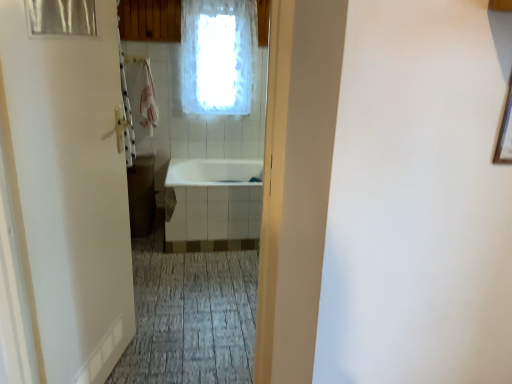
The height and width of the screenshot is (384, 512). Identify the location of white matte door at left. (68, 187).

Describe the element at coordinates (217, 56) in the screenshot. This screenshot has width=512, height=384. I see `white frosted glass window at upper center` at that location.

The height and width of the screenshot is (384, 512). In order to click on transparent plastic shower curtain at upper left in this screenshot , I will do `click(62, 17)`.

Would you consider white glossy bathtub at center to be distant from transparent plastic shower curtain at upper left?

Yes, white glossy bathtub at center and transparent plastic shower curtain at upper left are quite far apart.

From the image's perspective, is white glossy bathtub at center below transparent plastic shower curtain at upper left?

Yes.

Which object is thinner, white glossy bathtub at center or transparent plastic shower curtain at upper left?

A: transparent plastic shower curtain at upper left is thinner.

Is white frosted glass window at upper center to the right of white matte door at left from the viewer's perspective?

Correct, you'll find white frosted glass window at upper center to the right of white matte door at left.

Would you say white frosted glass window at upper center is outside white matte door at left?

Yes, white frosted glass window at upper center is located beyond the bounds of white matte door at left.

Does point (197, 41) come in front of point (103, 70)?

No, it is not.

Based on the photo, considering the relative sizes of white frosted glass window at upper center and white matte door at left in the image provided, is white frosted glass window at upper center wider than white matte door at left?

Correct, the width of white frosted glass window at upper center exceeds that of white matte door at left.

Could you tell me if white matte door at left is turned towards transparent plastic shower curtain at upper left?

Yes, white matte door at left is turned towards transparent plastic shower curtain at upper left.

At what (x,y) coordinates should I click in order to perform the action: click on shower curtain behind the white matte door at left. Please return your answer as a coordinate pair (x, y). This screenshot has width=512, height=384. Looking at the image, I should click on (62, 17).

In the scene shown: Between white matte door at left and transparent plastic shower curtain at upper left, which one has more height?

With more height is white matte door at left.

Is white matte door at left at the left side of transparent plastic shower curtain at upper left?

No, white matte door at left is not to the left of transparent plastic shower curtain at upper left.

Which is more to the left, transparent plastic shower curtain at upper left or white glossy bathtub at center?

transparent plastic shower curtain at upper left is more to the left.

Between transparent plastic shower curtain at upper left and white glossy bathtub at center, which one has smaller width?

With smaller width is transparent plastic shower curtain at upper left.

Is white glossy bathtub at center inside transparent plastic shower curtain at upper left?

Definitely not — white glossy bathtub at center is not inside transparent plastic shower curtain at upper left.

From the image's perspective, who appears lower, transparent plastic shower curtain at upper left or white glossy bathtub at center?

white glossy bathtub at center, from the image's perspective.

From the image's perspective, is white frosted glass window at upper center under transparent plastic shower curtain at upper left?

No, from the image's perspective, white frosted glass window at upper center is not beneath transparent plastic shower curtain at upper left.

From the picture: How different are the orientations of white frosted glass window at upper center and transparent plastic shower curtain at upper left in degrees?

The facing directions of white frosted glass window at upper center and transparent plastic shower curtain at upper left are 72.3 degrees apart.

Which of these two, white frosted glass window at upper center or transparent plastic shower curtain at upper left, is thinner?

Thinner between the two is transparent plastic shower curtain at upper left.

Considering the relative sizes of white glossy bathtub at center and white frosted glass window at upper center in the image provided, is white glossy bathtub at center shorter than white frosted glass window at upper center?

Correct, white glossy bathtub at center is not as tall as white frosted glass window at upper center.

Does white glossy bathtub at center have a lesser width compared to white frosted glass window at upper center?

Incorrect, the width of white glossy bathtub at center is not less than that of white frosted glass window at upper center.

Consider the image. Based on their positions, is white glossy bathtub at center located to the left or right of white frosted glass window at upper center?

From the image, it's evident that white glossy bathtub at center is to the left of white frosted glass window at upper center.

What's the angular difference between white glossy bathtub at center and white frosted glass window at upper center's facing directions?

0.715 degrees.

Is white frosted glass window at upper center inside transparent plastic shower curtain at upper left?

That's incorrect, white frosted glass window at upper center is not inside transparent plastic shower curtain at upper left.

Which is nearer, [49,25] or [237,71]?

Point [49,25] is closer to the camera than point [237,71].

From a real-world perspective, who is located higher, transparent plastic shower curtain at upper left or white frosted glass window at upper center?

From a 3D spatial view, transparent plastic shower curtain at upper left is above.

I want to click on shower curtain above the white glossy bathtub at center (from a real-world perspective), so click(x=62, y=17).

Identify the location of door located underneath the white frosted glass window at upper center (from a real-world perspective). The height and width of the screenshot is (384, 512). (68, 187).

Consider the image. When comparing their distances from white frosted glass window at upper center, does white matte door at left or white glossy bathtub at center seem closer?

The object closer to white frosted glass window at upper center is white glossy bathtub at center.

From the image, which object appears to be nearer to transparent plastic shower curtain at upper left, white frosted glass window at upper center or white glossy bathtub at center?

Among the two, white glossy bathtub at center is located nearer to transparent plastic shower curtain at upper left.

When comparing their distances from white matte door at left, does white glossy bathtub at center or transparent plastic shower curtain at upper left seem closer?

transparent plastic shower curtain at upper left is positioned closer to the anchor white matte door at left.

From the image, which object appears to be nearer to white frosted glass window at upper center, transparent plastic shower curtain at upper left or white matte door at left?

Based on the image, white matte door at left appears to be nearer to white frosted glass window at upper center.

Estimate the real-world distances between objects in this image. Which object is further from white matte door at left, transparent plastic shower curtain at upper left or white glossy bathtub at center?

white glossy bathtub at center.

From the image, which object appears to be nearer to transparent plastic shower curtain at upper left, white frosted glass window at upper center or white matte door at left?

Based on the image, white matte door at left appears to be nearer to transparent plastic shower curtain at upper left.

When comparing their distances from white frosted glass window at upper center, does white glossy bathtub at center or transparent plastic shower curtain at upper left seem closer?

white glossy bathtub at center is positioned closer to the anchor white frosted glass window at upper center.

Looking at the image, which one is located closer to white frosted glass window at upper center, white glossy bathtub at center or white matte door at left?

Among the two, white glossy bathtub at center is located nearer to white frosted glass window at upper center.

You are a GUI agent. You are given a task and a screenshot of the screen. Output one action in this format:
    pyautogui.click(x=<x>, y=<y>)
    Task: Click on the shower curtain between white matte door at left and white frosted glass window at upper center in the front-back direction
    This screenshot has height=384, width=512.
    Given the screenshot: What is the action you would take?
    pyautogui.click(x=62, y=17)

This screenshot has height=384, width=512. Find the location of `bath located between transparent plastic shower curtain at upper left and white frosted glass window at upper center in the depth direction`. bath located between transparent plastic shower curtain at upper left and white frosted glass window at upper center in the depth direction is located at coordinates (213, 205).

I want to click on shower curtain positioned between white matte door at left and white glossy bathtub at center from near to far, so click(x=62, y=17).

Find the location of a particular element. The width and height of the screenshot is (512, 384). bath between white matte door at left and white frosted glass window at upper center in the front-back direction is located at coordinates (213, 205).